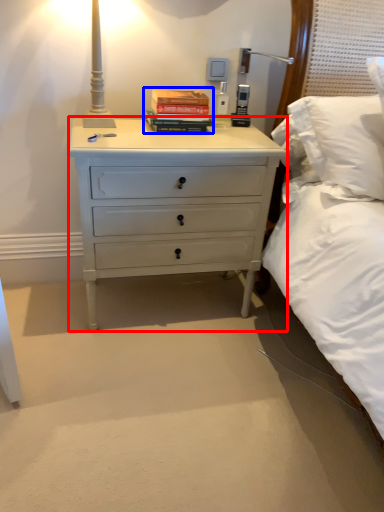
Question: Which of the following is the closest to the observer, chest of drawers (highlighted by a red box) or paperback book (highlighted by a blue box)?

Choices:
 (A) chest of drawers
 (B) paperback book

Answer: (A)